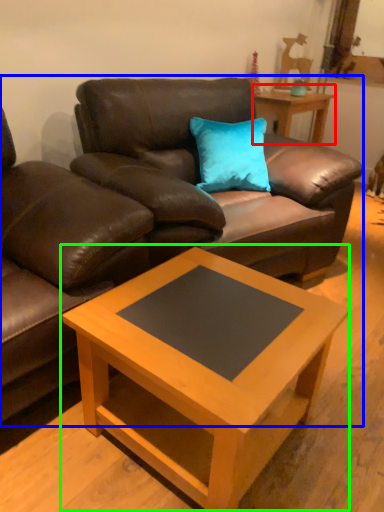
Question: Which is farther away from table (highlighted by a red box)? studio couch (highlighted by a blue box) or coffee table (highlighted by a green box)?

Choices:
 (A) studio couch
 (B) coffee table

Answer: (B)